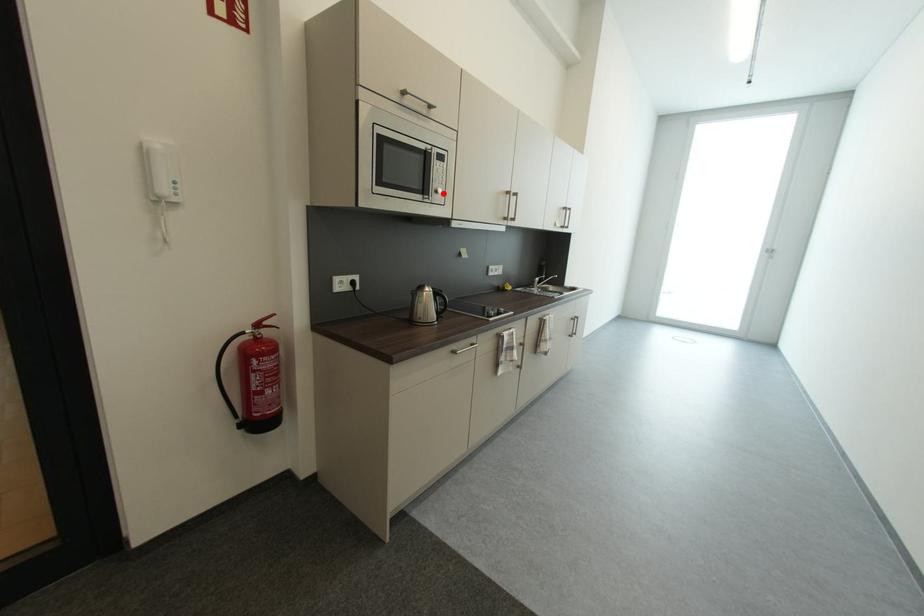
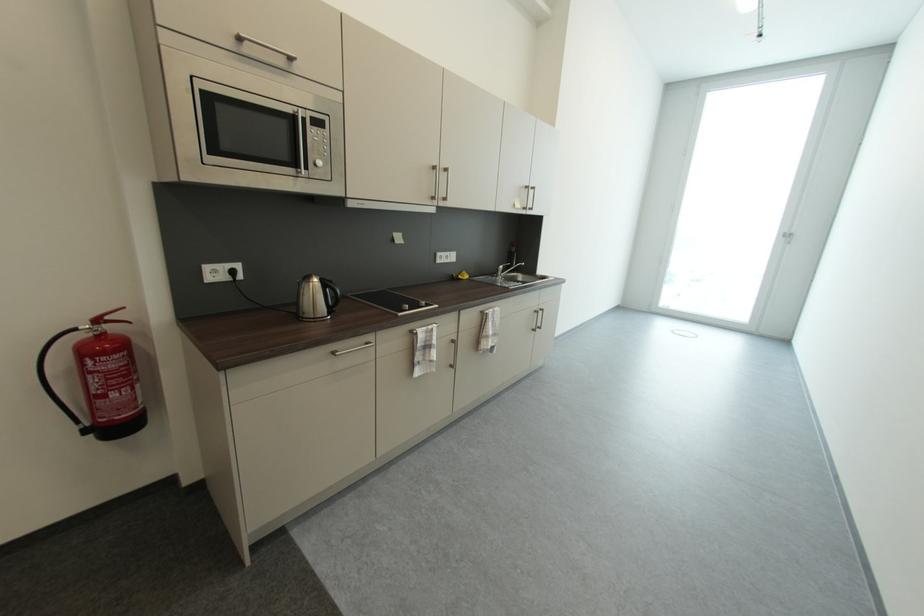
Find the pixel in the second image that matches the highlighted location in the first image.

(322, 166)